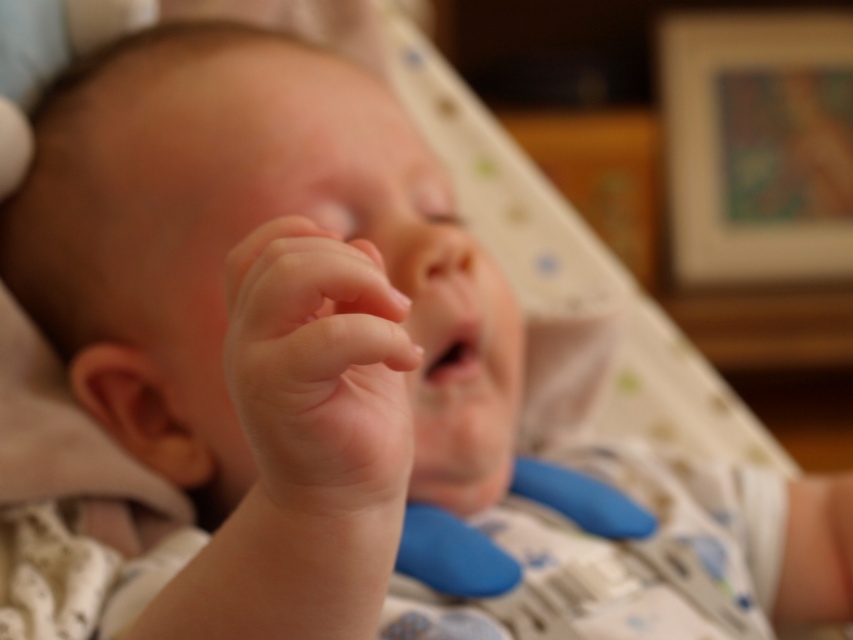
Question: Which of the following is the closest to the observer?

Choices:
 (A) (364, 348)
 (B) (477, 321)

Answer: (A)

Question: Which object is farther from the camera taking this photo?

Choices:
 (A) smooth flesh mouth at center
 (B) smooth flesh hand at center

Answer: (A)

Question: Where is smooth flesh hand at center located in relation to smooth flesh mouth at center in the image?

Choices:
 (A) above
 (B) below

Answer: (B)

Question: Can you confirm if smooth flesh hand at center is positioned below smooth flesh mouth at center?

Choices:
 (A) no
 (B) yes

Answer: (B)

Question: Which object appears closest to the camera in this image?

Choices:
 (A) smooth flesh hand at center
 (B) smooth flesh mouth at center

Answer: (A)

Question: Can you confirm if smooth flesh hand at center is thinner than smooth flesh mouth at center?

Choices:
 (A) yes
 (B) no

Answer: (B)